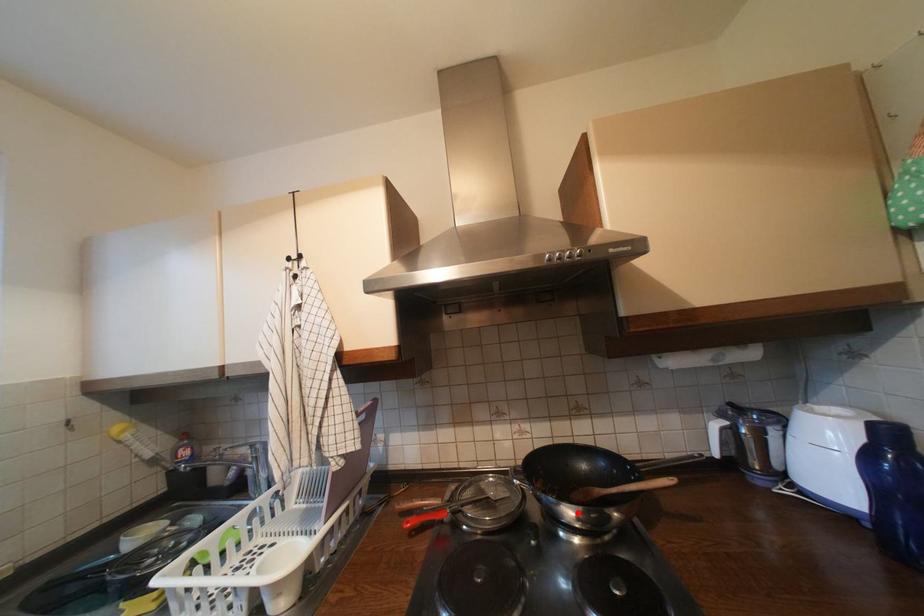
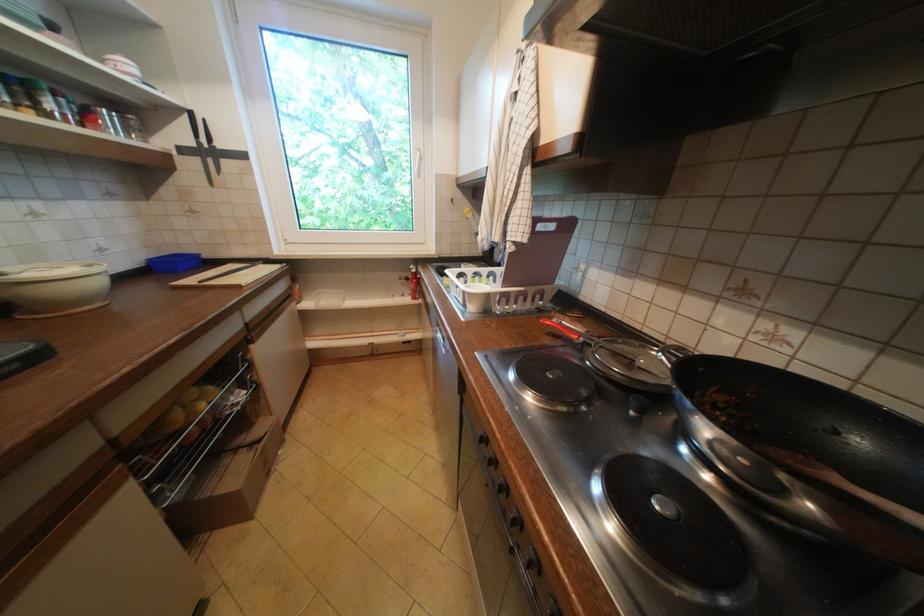
Find the pixel in the second image that matches the highlighted location in the first image.

(715, 430)